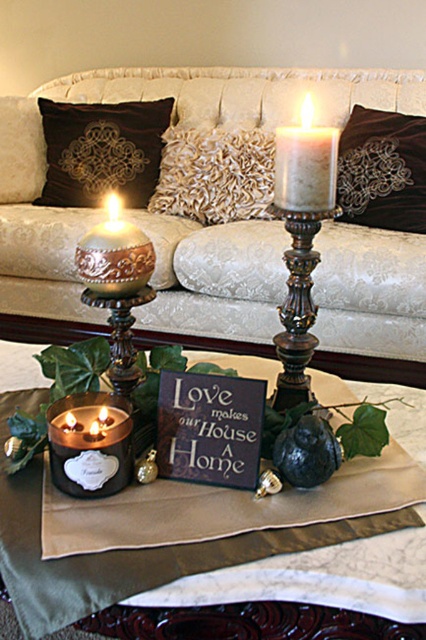
Based on the photo, who is shorter, matte black candle at center or gold textured candle at center?

gold textured candle at center is shorter.

Does point (89, 592) come in front of point (135, 250)?

Yes, it is.

In order to click on matte black candle at center in this screenshot , I will do `click(201, 570)`.

Does velvet pillow at upper left have a lesser width compared to matte gray candle at center?

No, velvet pillow at upper left is not thinner than matte gray candle at center.

In the scene shown: Who is more distant from viewer, (161, 108) or (314, 161)?

The point (161, 108) is more distant.

Measure the distance between point (135, 161) and camera.

A distance of 8.32 feet exists between point (135, 161) and camera.

What are the coordinates of `velvet pillow at upper left` in the screenshot? It's located at (101, 150).

Is matte black candle at center below gold textured pillow at center?

Indeed, matte black candle at center is positioned under gold textured pillow at center.

Find the location of a particular element. This screenshot has width=426, height=640. matte black candle at center is located at coordinates (201, 570).